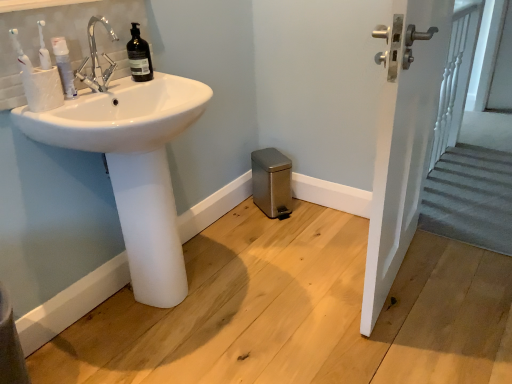
Locate an element on the screen. This screenshot has width=512, height=384. free region under white glossy door handle at upper right (from a real-world perspective) is located at coordinates (398, 271).